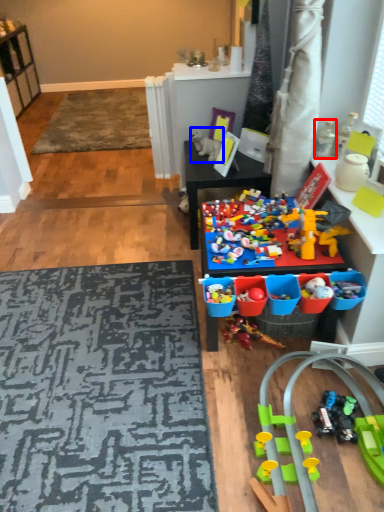
Question: Which of the following is the farthest to the observer, toy (highlighted by a red box) or toy (highlighted by a blue box)?

Choices:
 (A) toy
 (B) toy

Answer: (B)